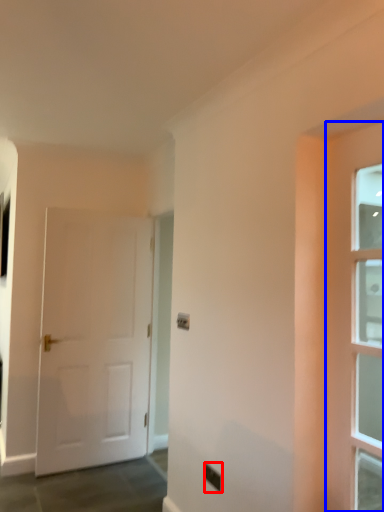
Question: Which of the following is the farthest to the observer, electric outlet (highlighted by a red box) or door (highlighted by a blue box)?

Choices:
 (A) electric outlet
 (B) door

Answer: (A)